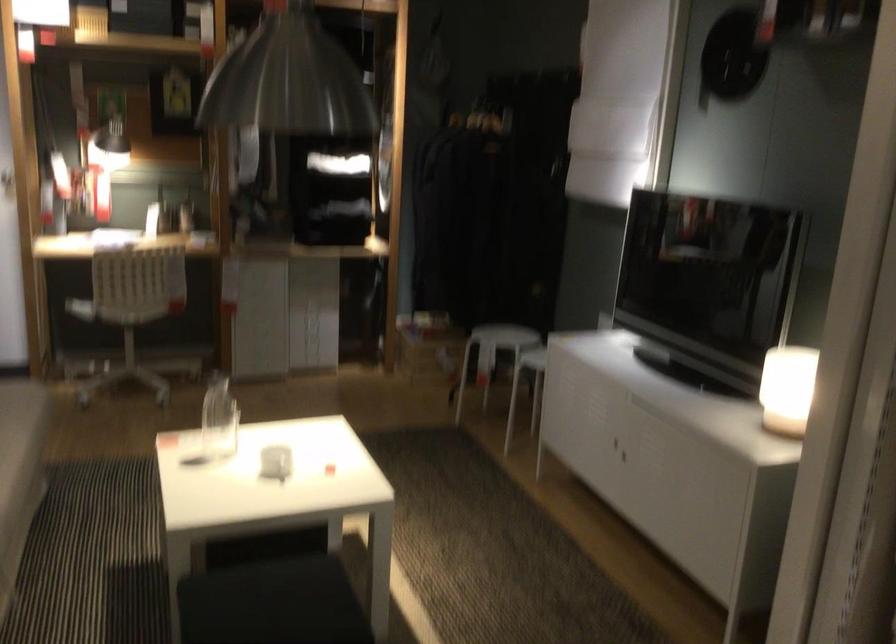
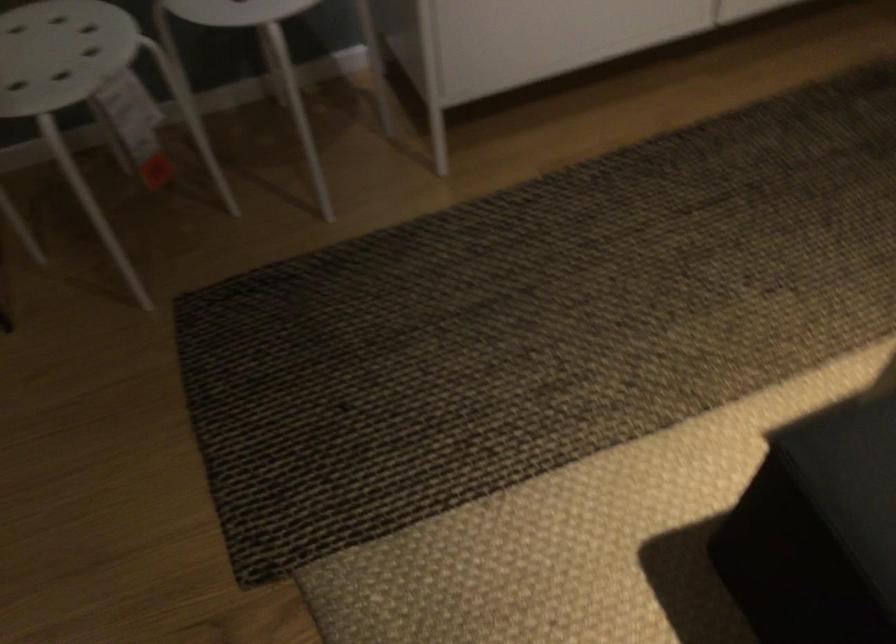
Where in the second image is the point corresponding to pixel 538 353 from the first image?

(235, 11)